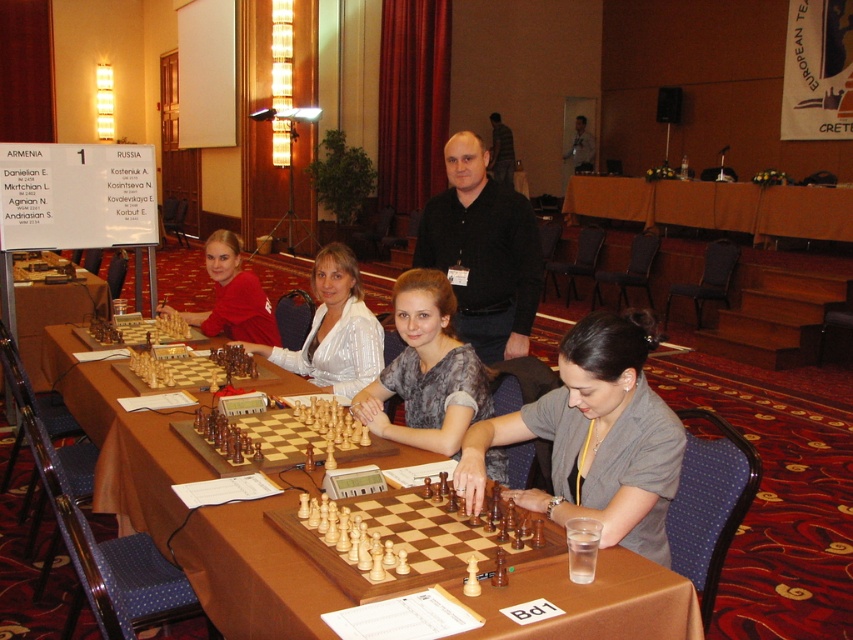
You are a chess player who wants to place a large chessboard on the table. The chessboard you have is as wide as the light brown wood chessboard at center. Will it fit entirely on the brown fabric table at center?

The brown fabric table at center is wider than the light brown wood chessboard at center, so yes, the chessboard will fit entirely on the brown fabric table at center.

You are a photographer at the chess tournament and want to capture a closeup of the gray textured blouse at center. Based on the coordinates provided, where should you focus your camera lens?

The gray textured blouse at center is located at coordinates point (427, 371), so focus the camera lens there to capture the closeup.

In the scene shown: You are a spectator at the chess tournament and want to take a photo of the wooden chess set at center and the dark gray shirt at center. To ensure both are in frame, which object should you position closer to the camera?

The wooden chess set at center is to the left of dark gray shirt at center, so you should position the dark gray shirt at center closer to the camera to ensure both are in frame.